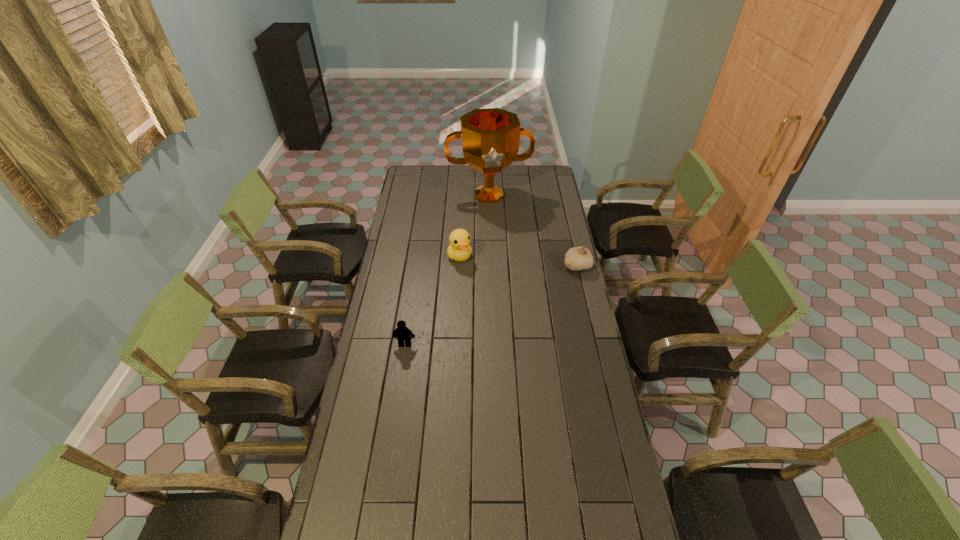
The width and height of the screenshot is (960, 540). I want to click on free spot between the nearest object and the garlic, so click(x=491, y=305).

Where is `object that is the third closest to the duck`? This screenshot has height=540, width=960. object that is the third closest to the duck is located at coordinates (401, 333).

Locate an element on the screen. This screenshot has height=540, width=960. the closest object to the second tallest object is located at coordinates (490, 137).

Locate an element on the screen. free point that satisfies the following two spatial constraints: 1. on the front side of the garlic; 2. on the right side of the tallest object is located at coordinates (491, 266).